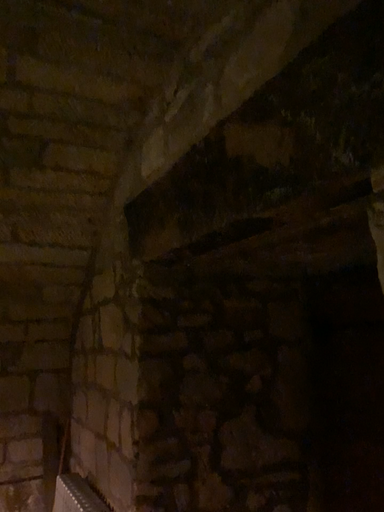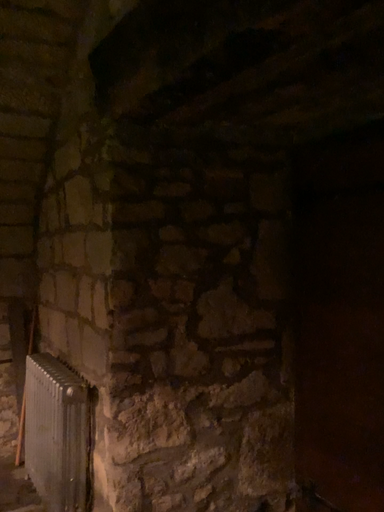
Question: Which way did the camera rotate in the video?

Choices:
 (A) rotated upward
 (B) rotated downward

Answer: (B)